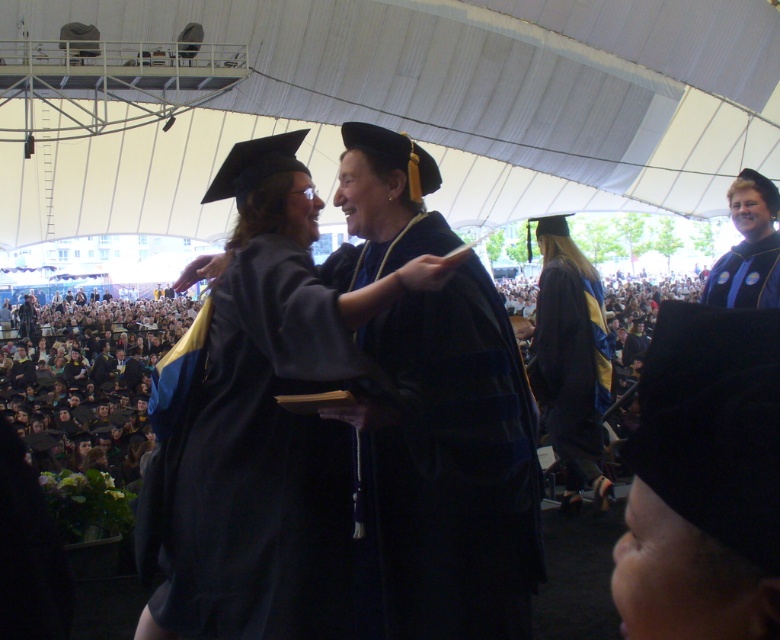
Can you confirm if matte black gown at center is bigger than matte black graduation gown at upper right?

Correct, matte black gown at center is larger in size than matte black graduation gown at upper right.

Who is higher up, matte black gown at center or matte black graduation gown at upper right?

matte black graduation gown at upper right is above.

Between point (257, 538) and point (741, 253), which one is positioned behind?

Positioned behind is point (741, 253).

Find the location of a particular element. This screenshot has width=780, height=640. matte black gown at center is located at coordinates tap(261, 461).

Measure the distance from matte black gown at center to black matte graduation cap at lower right.

matte black gown at center is 36.34 feet from black matte graduation cap at lower right.

Can you confirm if matte black gown at center is positioned to the left of black matte graduation cap at lower right?

Correct, you'll find matte black gown at center to the left of black matte graduation cap at lower right.

You are a GUI agent. You are given a task and a screenshot of the screen. Output one action in this format:
    pyautogui.click(x=<x>, y=<y>)
    Task: Click on the matte black gown at center
    This screenshot has height=640, width=780.
    Given the screenshot: What is the action you would take?
    pyautogui.click(x=261, y=461)

Image resolution: width=780 pixels, height=640 pixels. Describe the element at coordinates (449, 472) in the screenshot. I see `velvety black gown at center` at that location.

Can you confirm if velvety black gown at center is smaller than matte black graduation gown at upper right?

Incorrect, velvety black gown at center is not smaller in size than matte black graduation gown at upper right.

Between point (406, 625) and point (722, 259), which one is positioned behind?

The point (722, 259) is behind.

Where is `velvety black gown at center`? This screenshot has width=780, height=640. velvety black gown at center is located at coordinates (449, 472).